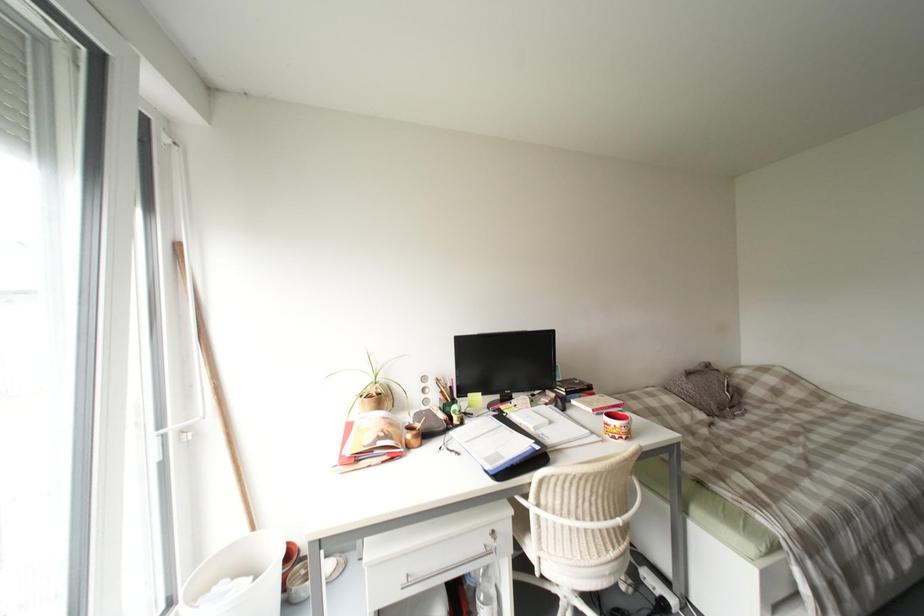
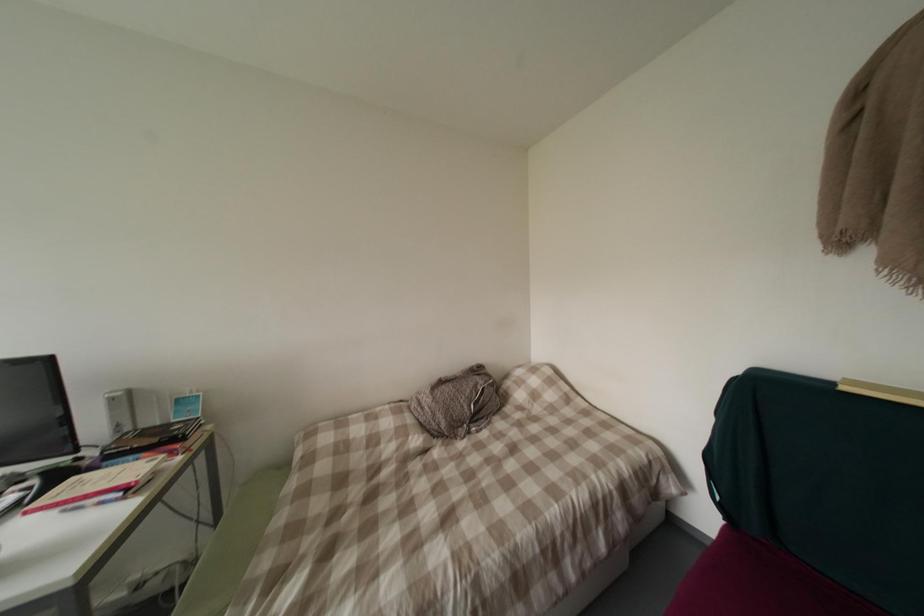
Question: Which direction would the cameraman need to move to produce the second image? Reply with the corresponding letter.

Choices:
 (A) Left
 (B) Right
 (C) Forward
 (D) Backward

Answer: (B)